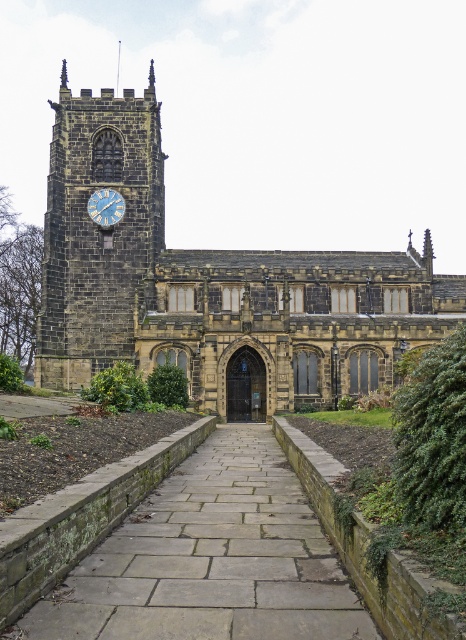
Looking at this image, you are standing in front of the historic stone church and want to take a photo of the dark gray stone church at center and the dark gray stone clock tower at upper left. Which one should you focus on first if you want to capture both in a single frame?

You should focus on the dark gray stone clock tower at upper left first because the dark gray stone church at center is located below it, so adjusting the camera angle to include both would require framing from the top downward.

You are standing on the gray stone path at center and want to walk towards the dark gray stone church at center. How does the width of the path compare to the church?

The dark gray stone church at center is wider than the gray stone path at center, so the path is narrower than the church.

You are standing in front of the historic stone church and want to walk towards the gray stone path at center. Which direction should you turn to face the blue painted metal clock at upper left?

You should turn to your left to face the blue painted metal clock at upper left because the gray stone path at center is to the right of the blue painted metal clock at upper left.